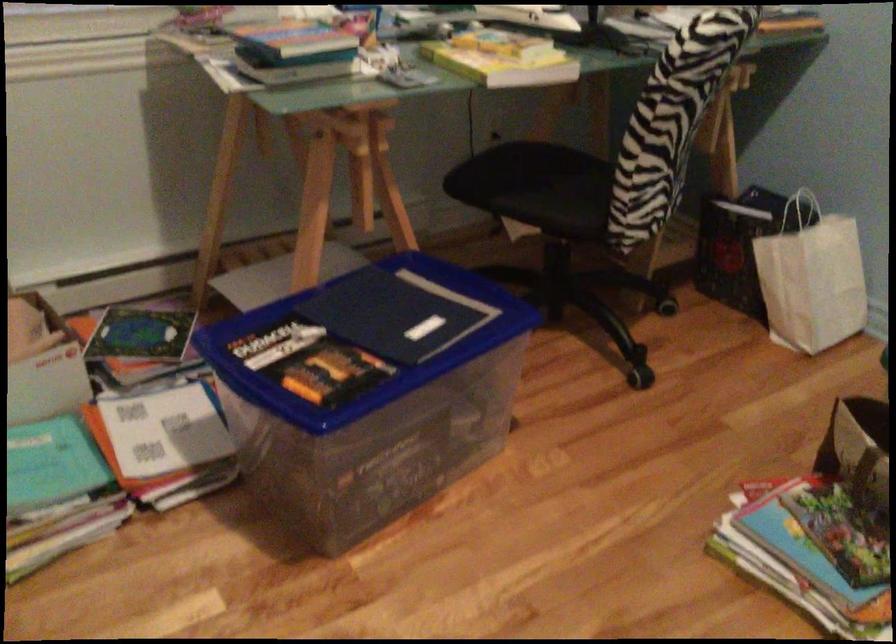
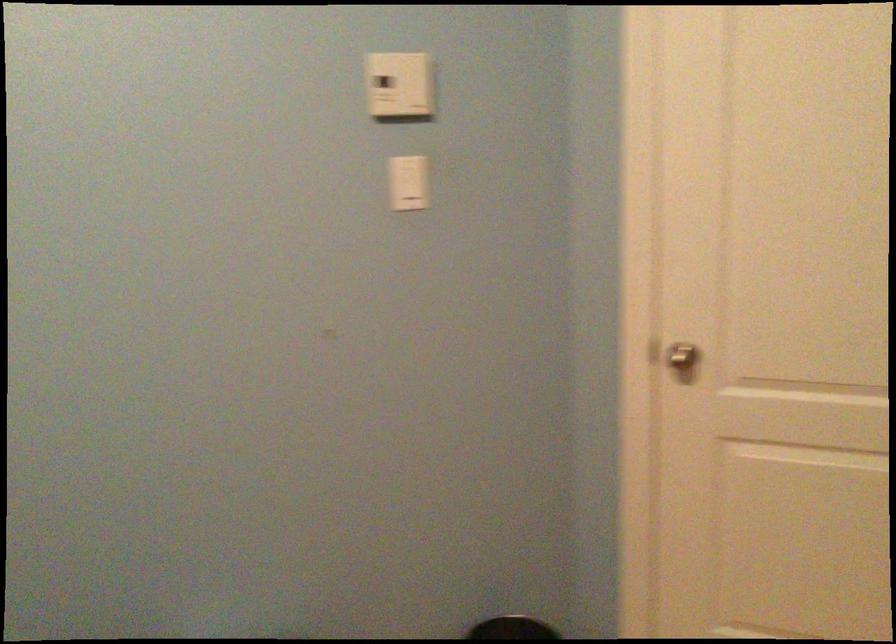
Question: The images are taken continuously from a first-person perspective. In which direction is your viewpoint rotating?

Choices:
 (A) Left
 (B) Right
 (C) Up
 (D) Down

Answer: (B)